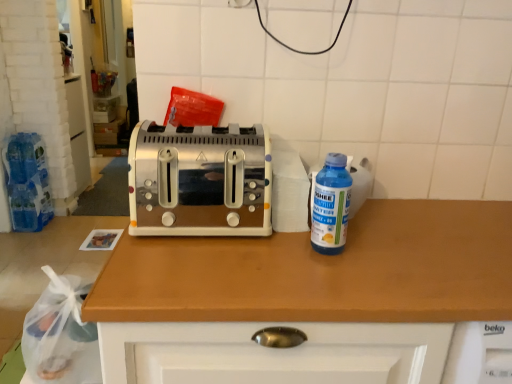
Question: From the image's perspective, is blue plastic bottle at right above satin silver toaster at center?

Choices:
 (A) no
 (B) yes

Answer: (A)

Question: Is blue plastic bottle at right next to satin silver toaster at center and touching it?

Choices:
 (A) yes
 (B) no

Answer: (B)

Question: From the image's perspective, would you say blue plastic bottle at right is shown under satin silver toaster at center?

Choices:
 (A) no
 (B) yes

Answer: (B)

Question: Does blue plastic bottle at right appear on the right side of satin silver toaster at center?

Choices:
 (A) no
 (B) yes

Answer: (B)

Question: Is blue plastic bottle at right looking in the opposite direction of satin silver toaster at center?

Choices:
 (A) no
 (B) yes

Answer: (A)

Question: In the image, is blue plastic bottle at right positioned in front of or behind satin silver toaster at center?

Choices:
 (A) behind
 (B) front

Answer: (B)

Question: Based on their positions, is blue plastic bottle at right located to the left or right of satin silver toaster at center?

Choices:
 (A) right
 (B) left

Answer: (A)

Question: Is point (333, 213) positioned closer to the camera than point (231, 218)?

Choices:
 (A) closer
 (B) farther

Answer: (A)

Question: From the image's perspective, is blue plastic bottle at right above or below satin silver toaster at center?

Choices:
 (A) below
 (B) above

Answer: (A)

Question: From a real-world perspective, is wooden countertop at center above or below blue plastic bottle at right?

Choices:
 (A) above
 (B) below

Answer: (B)

Question: Does point (271, 304) appear closer or farther from the camera than point (329, 210)?

Choices:
 (A) closer
 (B) farther

Answer: (A)

Question: Do you think wooden countertop at center is within blue plastic bottle at right, or outside of it?

Choices:
 (A) outside
 (B) inside

Answer: (A)

Question: From the image's perspective, is wooden countertop at center above or below blue plastic bottle at right?

Choices:
 (A) above
 (B) below

Answer: (B)

Question: Is satin silver toaster at center inside the boundaries of blue plastic bottle at right, or outside?

Choices:
 (A) outside
 (B) inside

Answer: (A)

Question: Considering the positions of satin silver toaster at center and blue plastic bottle at right in the image, is satin silver toaster at center bigger or smaller than blue plastic bottle at right?

Choices:
 (A) big
 (B) small

Answer: (A)